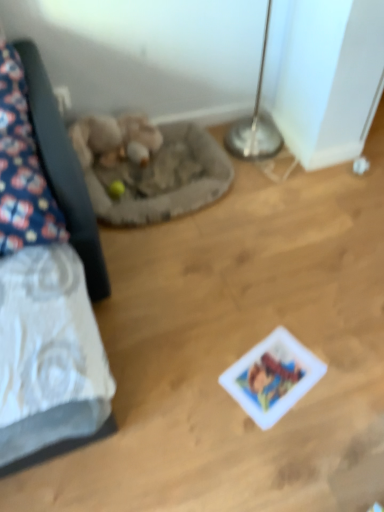
Find the location of `free area in between gray fabric cat bed at center-left and white glossy card at center`. free area in between gray fabric cat bed at center-left and white glossy card at center is located at coordinates (214, 276).